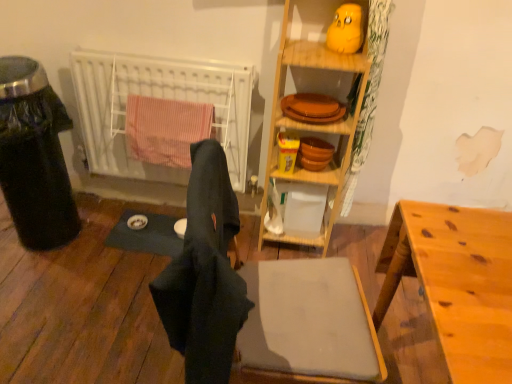
Question: From the image's perspective, does dark fabric laundry at center appear lower than dark gray fabric yoga mat at center?

Choices:
 (A) no
 (B) yes

Answer: (B)

Question: Considering the relative sizes of dark fabric laundry at center and dark gray fabric yoga mat at center in the image provided, is dark fabric laundry at center shorter than dark gray fabric yoga mat at center?

Choices:
 (A) yes
 (B) no

Answer: (B)

Question: Does dark fabric laundry at center turn towards dark gray fabric yoga mat at center?

Choices:
 (A) yes
 (B) no

Answer: (B)

Question: Is dark fabric laundry at center positioned beyond the bounds of dark gray fabric yoga mat at center?

Choices:
 (A) no
 (B) yes

Answer: (B)

Question: Is dark fabric laundry at center to the left of dark gray fabric yoga mat at center from the viewer's perspective?

Choices:
 (A) yes
 (B) no

Answer: (B)

Question: From a real-world perspective, is dark fabric laundry at center located higher than dark gray fabric yoga mat at center?

Choices:
 (A) no
 (B) yes

Answer: (B)

Question: From the image's perspective, is orange matte tray at center located beneath matte orange plates at upper center?

Choices:
 (A) no
 (B) yes

Answer: (B)

Question: Is orange matte tray at center positioned beyond the bounds of matte orange plates at upper center?

Choices:
 (A) no
 (B) yes

Answer: (B)

Question: Is orange matte tray at center aimed at matte orange plates at upper center?

Choices:
 (A) yes
 (B) no

Answer: (B)

Question: Is orange matte tray at center positioned with its back to matte orange plates at upper center?

Choices:
 (A) yes
 (B) no

Answer: (B)

Question: Is orange matte tray at center surrounding matte orange plates at upper center?

Choices:
 (A) no
 (B) yes

Answer: (A)

Question: Does orange matte tray at center have a larger size compared to matte orange plates at upper center?

Choices:
 (A) no
 (B) yes

Answer: (A)

Question: Does matte orange plates at upper center have a lesser height compared to dark fabric laundry at center?

Choices:
 (A) yes
 (B) no

Answer: (A)